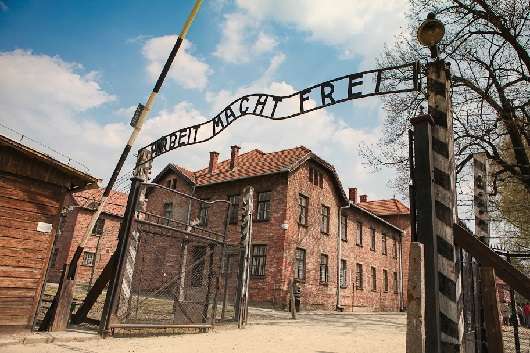
Identify the location of chimney. This screenshot has height=353, width=530. (210, 161).